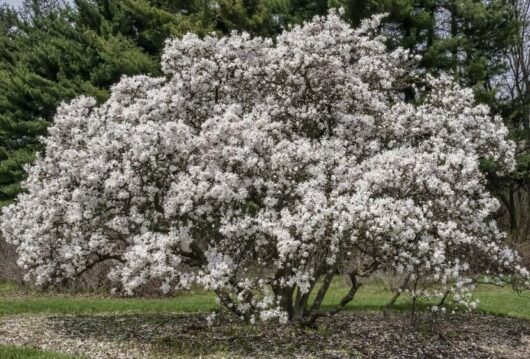
The image size is (530, 359). Find the location of `white pedistals`. white pedistals is located at coordinates (247, 136).